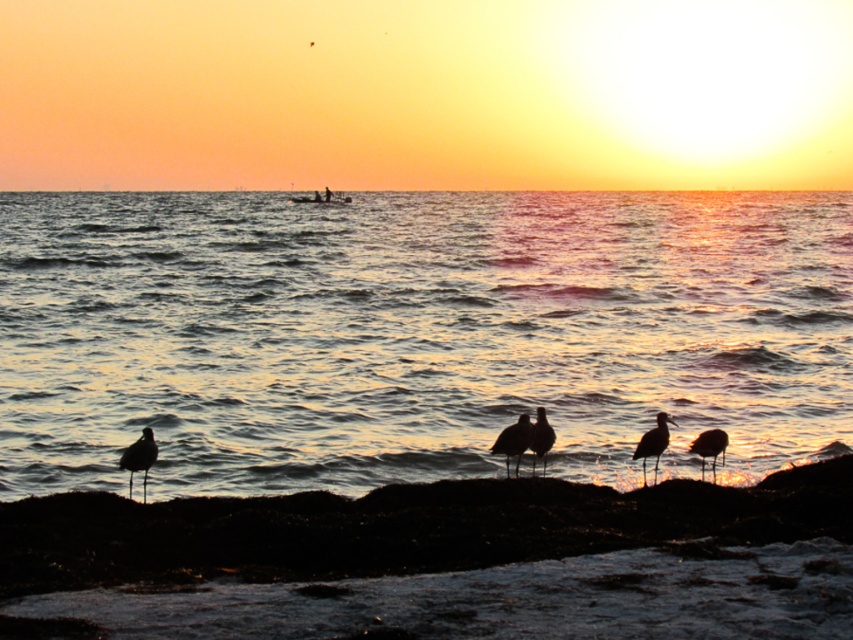
In the scene shown: Is silhouette feathered bird at center taller than silvery feathered bird at center?

No.

Can you confirm if silhouette feathered bird at center is wider than silvery feathered bird at center?

Yes.

What do you see at coordinates (514, 440) in the screenshot?
I see `silhouette feathered bird at center` at bounding box center [514, 440].

Image resolution: width=853 pixels, height=640 pixels. I want to click on silhouette feathered bird at center, so click(x=514, y=440).

Which is more to the left, silhouette feathered bird at center or silvery metallic seagull at lower right?

From the viewer's perspective, silhouette feathered bird at center appears more on the left side.

Does silhouette feathered bird at center have a lesser height compared to silvery metallic seagull at lower right?

Incorrect, silhouette feathered bird at center's height does not fall short of silvery metallic seagull at lower right's.

The width and height of the screenshot is (853, 640). What are the coordinates of `silhouette feathered bird at center` in the screenshot? It's located at (514, 440).

Identify the location of silhouette feathered bird at center. The width and height of the screenshot is (853, 640). (514, 440).

Which is behind, point (120, 346) or point (143, 428)?

The point (120, 346) is behind.

Does shiny metallic water at center appear on the left side of silhouette feathered bird at lower left?

In fact, shiny metallic water at center is to the right of silhouette feathered bird at lower left.

Image resolution: width=853 pixels, height=640 pixels. What do you see at coordinates (415, 333) in the screenshot?
I see `shiny metallic water at center` at bounding box center [415, 333].

Identify the location of shiny metallic water at center. The image size is (853, 640). (415, 333).